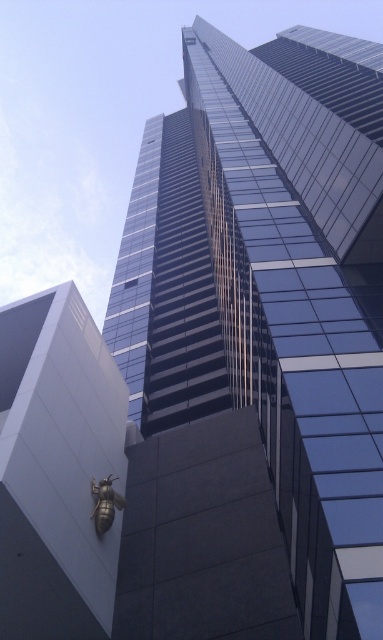
You are standing at the point indicated by point (273,291) in the image. What structure are you facing?

You are facing the glassy blue skyscraper at center, as the point (273,291) indicates this structure.

You are an architect reviewing a city model. You notice the glassy blue skyscraper at center and the gold metallic bee at lower left. Which object is positioned higher in the scene?

The glassy blue skyscraper at center is positioned higher than the gold metallic bee at lower left according to the description.

You are standing in the city square and want to take a photo of the glassy blue skyscraper at center and the gold metallic bee at lower left. Which object should you focus on first if you want both to be in sharp focus?

You should focus on the glassy blue skyscraper at center first because it is closer to the viewer than the gold metallic bee at lower left, so adjusting focus from near to far will help both be in sharp focus.